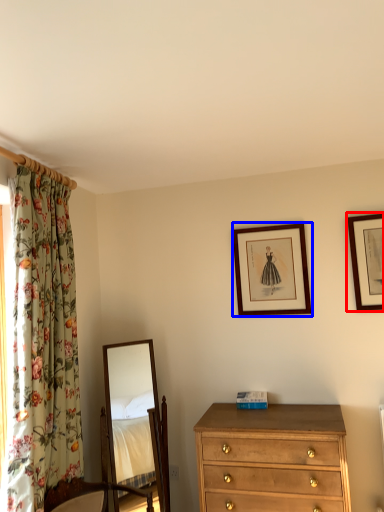
Question: Among these objects, which one is nearest to the camera, picture frame (highlighted by a red box) or picture frame (highlighted by a blue box)?

Choices:
 (A) picture frame
 (B) picture frame

Answer: (A)